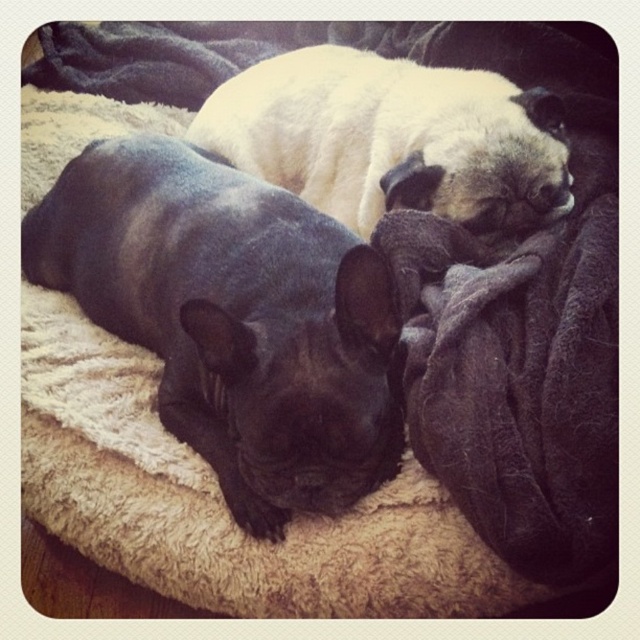
Question: Can you confirm if dark gray plush blanket at center-right is thinner than white fur dog at upper center?

Choices:
 (A) yes
 (B) no

Answer: (A)

Question: Estimate the real-world distances between objects in this image. Which object is farther from the black smooth french bulldog at left?

Choices:
 (A) dark gray plush blanket at center-right
 (B) white fur dog at upper center

Answer: (B)

Question: Which point is closer to the camera taking this photo?

Choices:
 (A) (406, 132)
 (B) (547, 352)

Answer: (B)

Question: Estimate the real-world distances between objects in this image. Which object is farther from the white fur dog at upper center?

Choices:
 (A) dark gray plush blanket at center-right
 (B) black smooth french bulldog at left

Answer: (B)

Question: Is black smooth french bulldog at left to the left of white fur dog at upper center from the viewer's perspective?

Choices:
 (A) no
 (B) yes

Answer: (B)

Question: Is black smooth french bulldog at left to the left of dark gray plush blanket at center-right from the viewer's perspective?

Choices:
 (A) no
 (B) yes

Answer: (B)